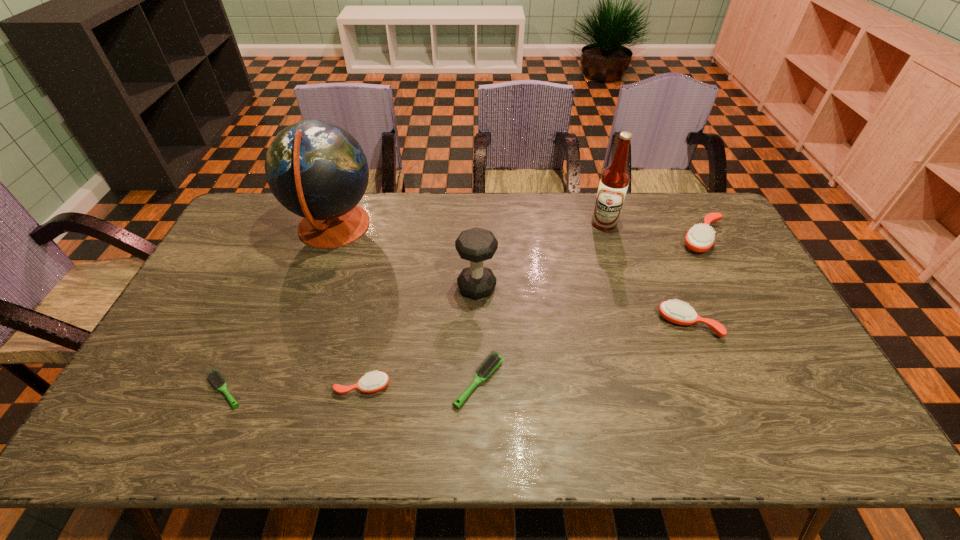
You are a GUI agent. You are given a task and a screenshot of the screen. Output one action in this format:
    pyautogui.click(x=<x>, y=<y>)
    Task: Click on the free space at the right edge of the desktop
    This screenshot has height=540, width=960.
    Given the screenshot: What is the action you would take?
    pyautogui.click(x=746, y=255)

The height and width of the screenshot is (540, 960). I want to click on vacant space at the far right corner, so click(696, 222).

This screenshot has width=960, height=540. I want to click on vacant region at the near right corner of the desktop, so click(x=799, y=418).

Find the location of a particular element. vacant space in between the red alcohol and the second farthest orange hairbrush is located at coordinates (646, 274).

Find the location of `free space between the biggest orange hairbrush and the fifth farthest object`. free space between the biggest orange hairbrush and the fifth farthest object is located at coordinates (695, 281).

Find the location of a particular element. This screenshot has width=960, height=540. vacant space that is in between the biggest orange hairbrush and the fourth hairbrush from right to left is located at coordinates (533, 313).

Image resolution: width=960 pixels, height=540 pixels. I want to click on empty location between the red alcohol and the rightmost object, so click(654, 231).

The width and height of the screenshot is (960, 540). What are the coordinates of `empty space between the red alcohol and the farthest hairbrush` in the screenshot? It's located at (654, 231).

Identify the location of free space between the tallest hairbrush and the third hairbrush from right to left. The height and width of the screenshot is (540, 960). (590, 310).

Where is `vacant space that's between the right light hairbrush and the nearest orange hairbrush`? This screenshot has width=960, height=540. vacant space that's between the right light hairbrush and the nearest orange hairbrush is located at coordinates (420, 384).